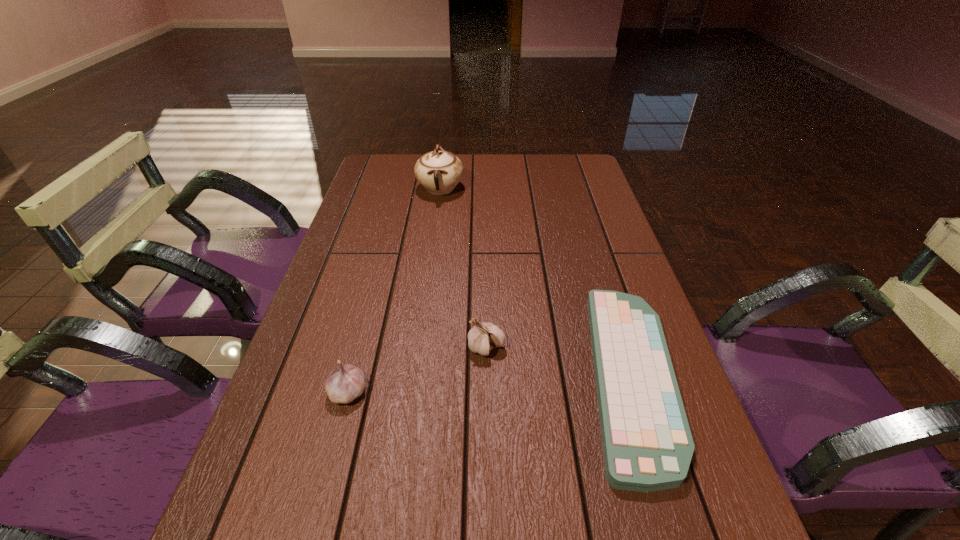
This screenshot has height=540, width=960. In order to click on vacant space located 0.280m on the right of the leftmost object in this screenshot , I will do `click(510, 391)`.

This screenshot has height=540, width=960. Identify the location of vacant position located 0.210m on the left of the shortest object. (480, 376).

Identify the location of object located at the far edge. The height and width of the screenshot is (540, 960). (439, 171).

This screenshot has width=960, height=540. I want to click on object that is at the left edge, so click(346, 382).

Locate an element on the screen. object positioned at the right edge is located at coordinates (647, 444).

You are a GUI agent. You are given a task and a screenshot of the screen. Output one action in this format:
    pyautogui.click(x=<x>, y=<y>)
    Task: Click on the vacant space at the far edge
    The width and height of the screenshot is (960, 540).
    Given the screenshot: What is the action you would take?
    pyautogui.click(x=415, y=185)

I want to click on blank space at the left edge, so click(x=348, y=405).

At what (x,y) coordinates should I click in order to perform the action: click on free space at the right edge of the desktop. Please return your answer as a coordinate pair (x, y). Looking at the image, I should click on (628, 500).

Where is `vacant space at the far right corner of the desktop`? vacant space at the far right corner of the desktop is located at coordinates (558, 180).

Where is `vacant point located between the leftmost object and the farther garlic`? Image resolution: width=960 pixels, height=540 pixels. vacant point located between the leftmost object and the farther garlic is located at coordinates coord(418,369).